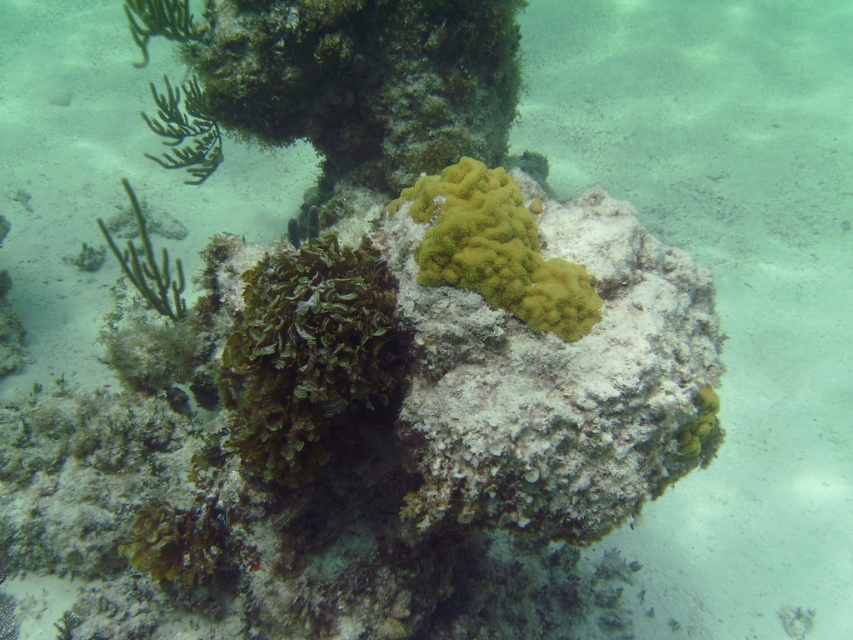
Does green leafy algae at center have a smaller size compared to yellow coral at center?

Incorrect, green leafy algae at center is not smaller in size than yellow coral at center.

Which of these two, green leafy algae at center or yellow coral at center, stands shorter?

With less height is yellow coral at center.

Find the location of `green leafy algae at center`. green leafy algae at center is located at coordinates [306, 353].

I want to click on green leafy algae at center, so click(x=306, y=353).

Is green leafy algae at center behind green matte algae at left?

No, green leafy algae at center is in front of green matte algae at left.

Where is `green leafy algae at center`? green leafy algae at center is located at coordinates (306, 353).

Can you confirm if yellow coral at center is positioned below green matte algae at left?

Yes, yellow coral at center is below green matte algae at left.

Does yellow coral at center have a greater height compared to green matte algae at left?

No.

Image resolution: width=853 pixels, height=640 pixels. What do you see at coordinates (496, 250) in the screenshot?
I see `yellow coral at center` at bounding box center [496, 250].

You are a GUI agent. You are given a task and a screenshot of the screen. Output one action in this format:
    pyautogui.click(x=<x>, y=<y>)
    Task: Click on the yellow coral at center
    This screenshot has width=853, height=640.
    Given the screenshot: What is the action you would take?
    pyautogui.click(x=496, y=250)